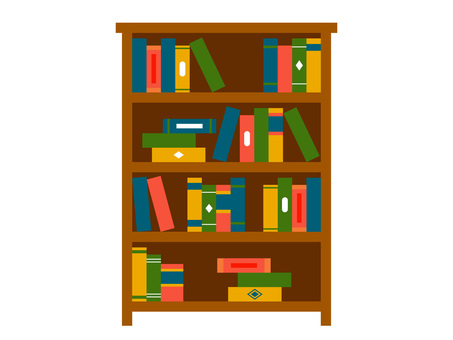
Locate an element on the screen. backs behind shelves is located at coordinates (231, 60), (143, 118), (177, 195), (200, 281).